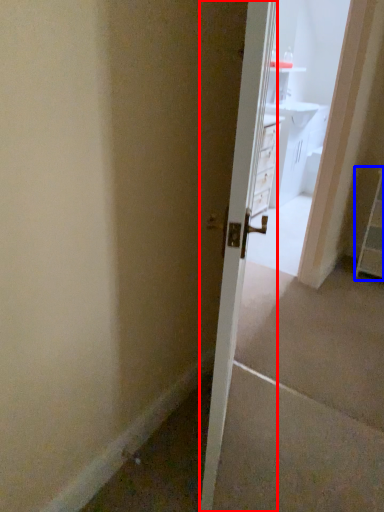
Question: Among these objects, which one is farthest to the camera, door (highlighted by a red box) or dresser (highlighted by a blue box)?

Choices:
 (A) door
 (B) dresser

Answer: (B)